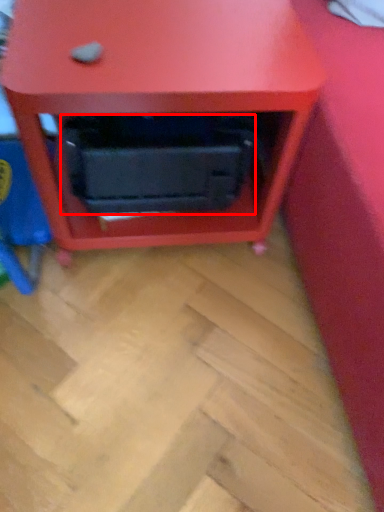
Question: From the image's perspective, what is the correct spatial relationship of drawer (annotated by the red box) in relation to furniture?

Choices:
 (A) above
 (B) below

Answer: (B)